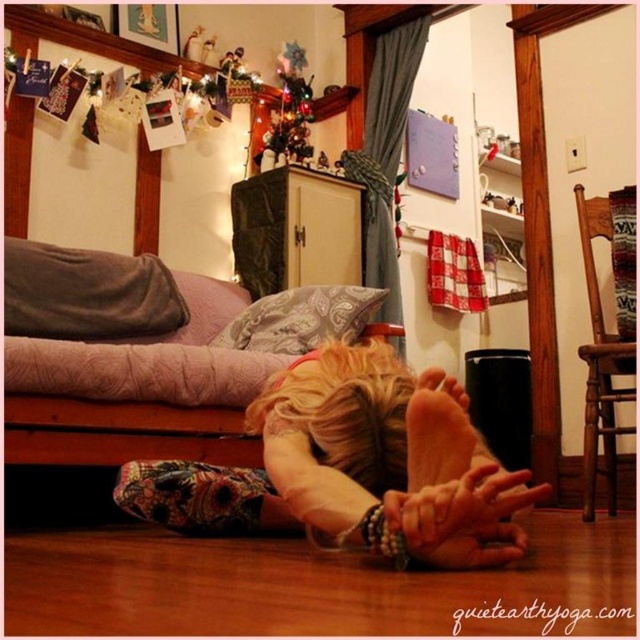
You are a photographer setting up a shoot in this room. You need to decide which object, the blonde hair at lower center or the velvety gray pillow at upper left, requires more space in your composition. Which one should you prioritize?

The blonde hair at lower center requires more space in your composition because it is larger in size than the velvety gray pillow at upper left.

Based on the photo, you are standing at the origin point in the room. There is a point at coordinates (352,467). What is located at that point?

At point (352,467) lies blonde hair at lower center.